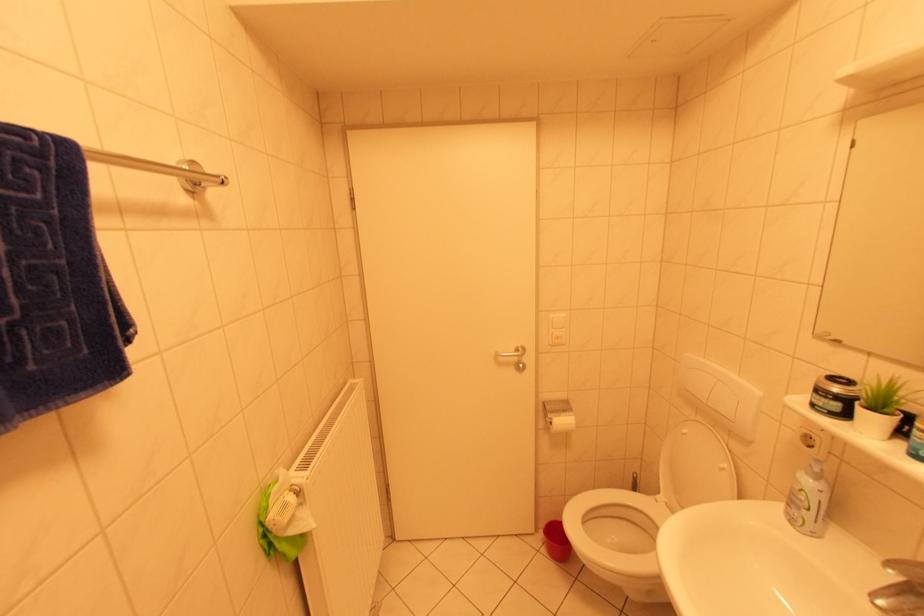
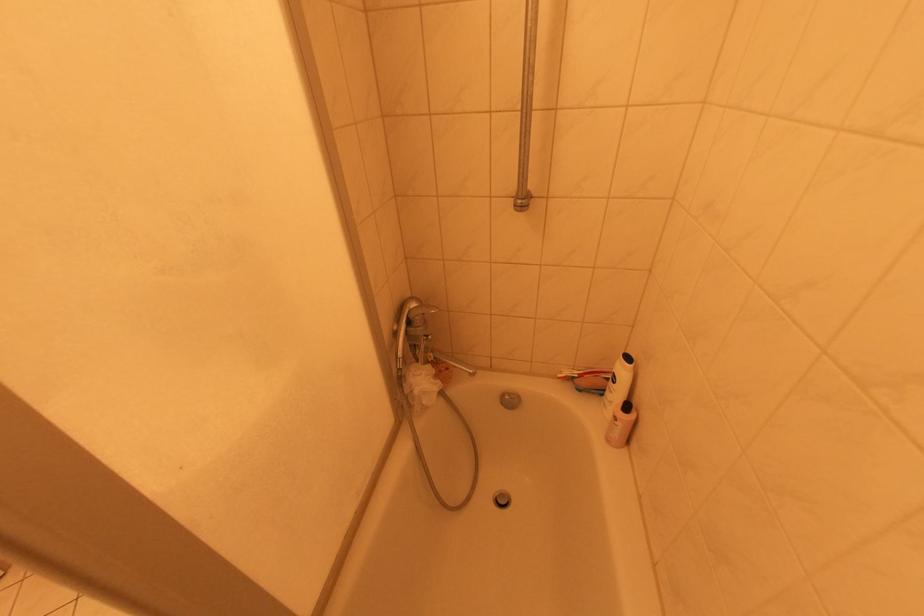
The images are taken continuously from a first-person perspective. In which direction is your viewpoint rotating?

The rotation direction of the camera is right-down.